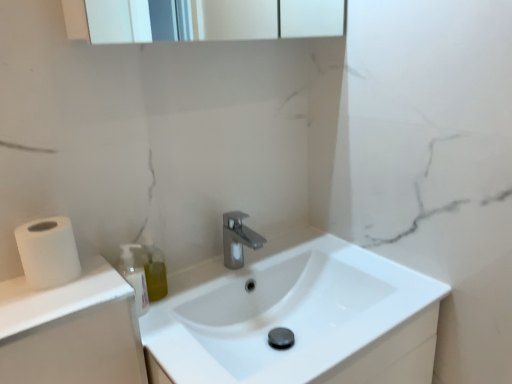
Identify the location of free spot to the right of translucent plastic soap dispenser at left. (181, 298).